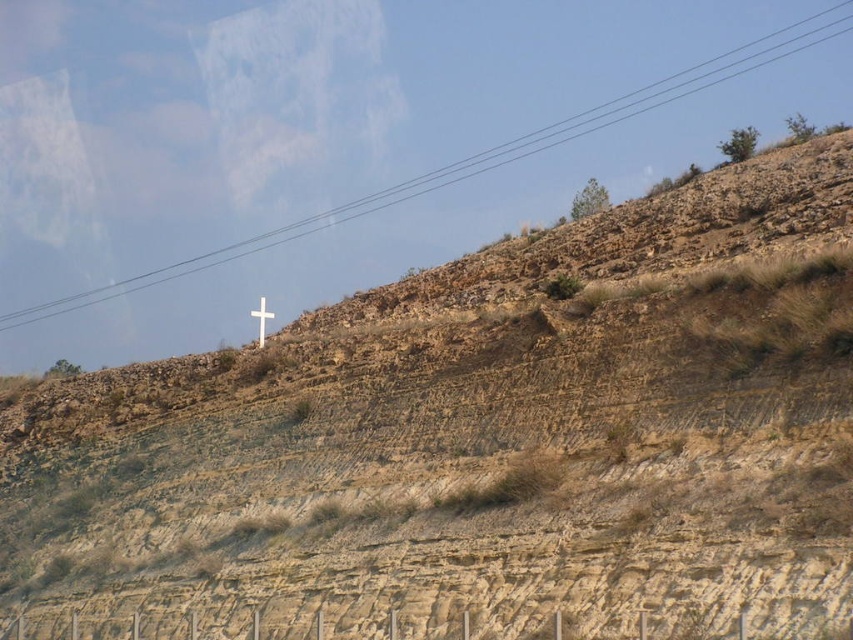
You are an artist planning to paint this hillside scene. You want to ensure the black wire at upper center and the white wooden cross at upper center are proportionally accurate. Which object should you draw wider in your painting?

The black wire at upper center should be drawn wider because its width is larger than the white wooden cross at upper center.

You are a hiker who wants to place a small red flag at point (480, 157). You see the black wire at upper center located at that point. Can you place the flag there?

The point (480, 157) is occupied by the black wire at upper center, so you cannot place the flag there.